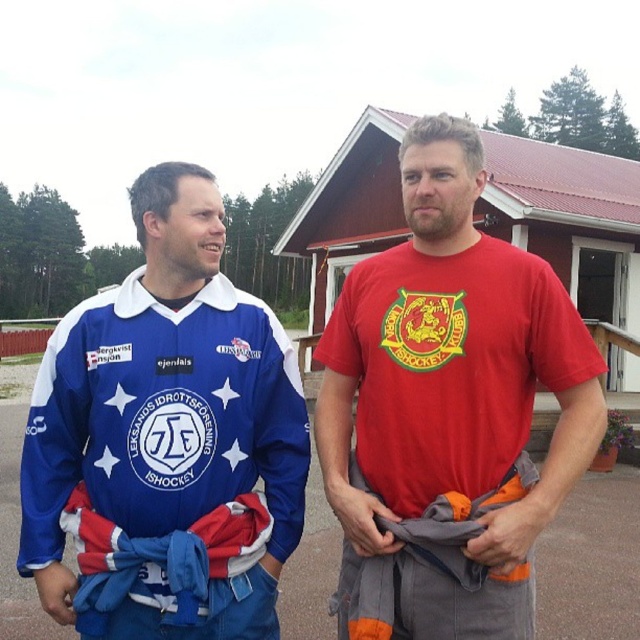
Does blue jersey at center lie behind red matte t-shirt at center?

Yes, it is.

Which is in front, point (273, 544) or point (385, 548)?

Positioned in front is point (385, 548).

Between point (49, 420) and point (352, 269), which one is positioned behind?

Point (352, 269)

Identify the location of blue jersey at center. (164, 440).